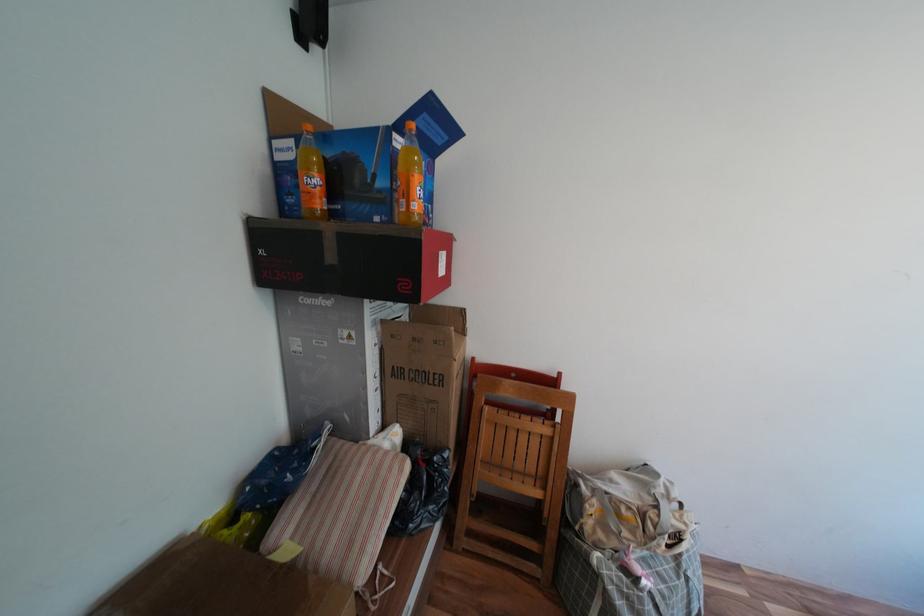
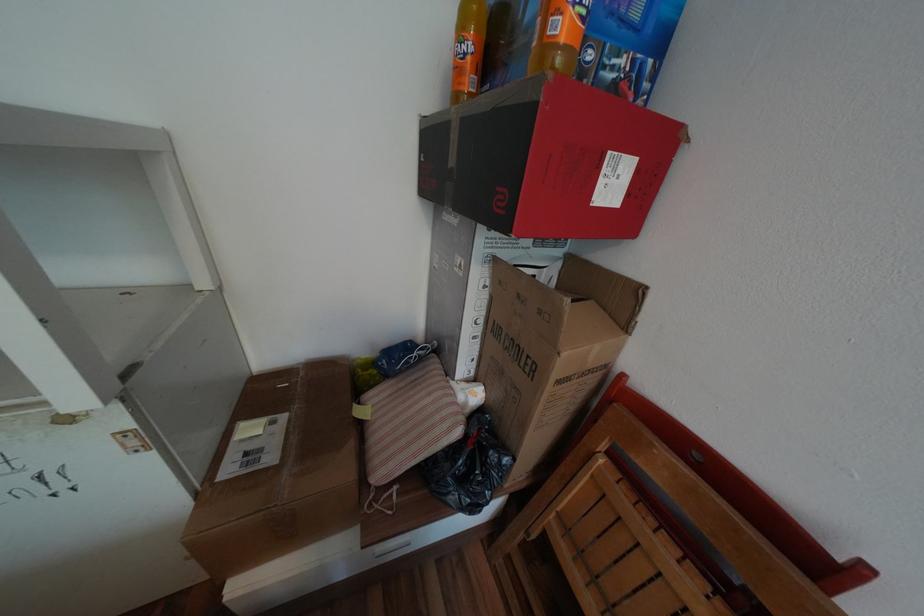
Based on the continuous images, in which direction is the camera rotating?

The camera's rotation is toward left-down.